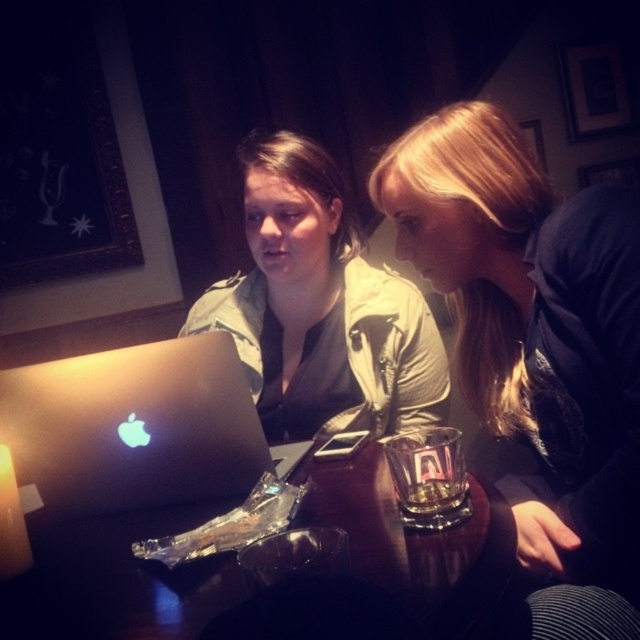
You are a photographer trying to capture a closeup shot of the blonde hair at upper right and the wooden table at center. Which object is narrower?

The blonde hair at upper right is narrower than the wooden table at center.

You are a photographer trying to capture a candid shot of the blonde hair at upper right and the wooden table at center. Which object is positioned higher in the frame?

The blonde hair at upper right is much taller than the wooden table at center, so it is positioned higher in the frame.

You are a delivery person who needs to place a small package on the table. The package is 10 cm in width. Can the matte khaki jacket at center and the wooden table at center accommodate the package without overlapping?

The matte khaki jacket at center has a larger size compared to wooden table at center. Therefore, the wooden table at center may not have enough space to place the package since the jacket is taking up more space.